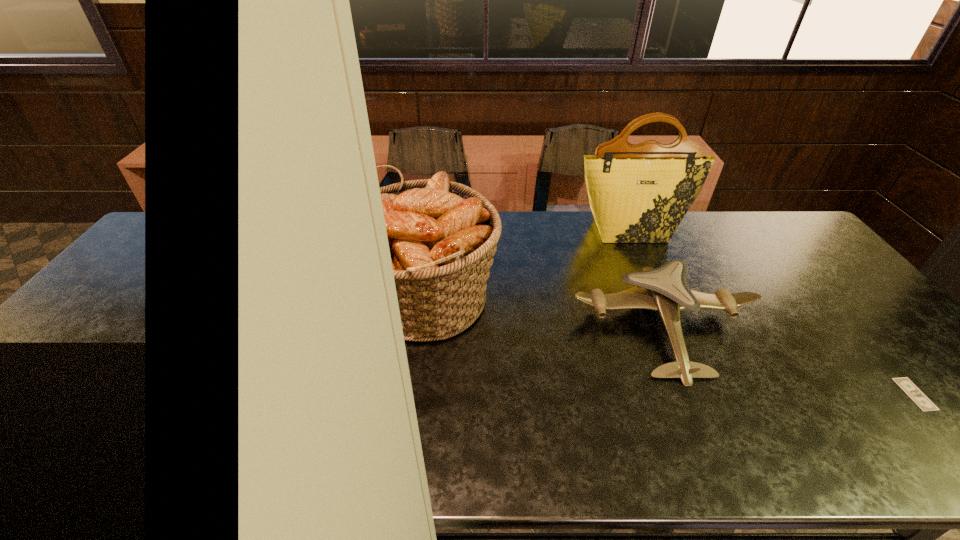
Where is `the farthest object`? This screenshot has height=540, width=960. the farthest object is located at coordinates (639, 193).

At what (x,y) coordinates should I click in order to perform the action: click on tote bag. Please return your answer as a coordinate pair (x, y). The height and width of the screenshot is (540, 960). Looking at the image, I should click on (639, 193).

You are a GUI agent. You are given a task and a screenshot of the screen. Output one action in this format:
    pyautogui.click(x=<x>, y=<y>)
    Task: Click on the leftmost object
    
    Given the screenshot: What is the action you would take?
    pyautogui.click(x=442, y=235)

Find the location of a particular element. The image size is (960, 540). basket is located at coordinates (442, 235).

Image resolution: width=960 pixels, height=540 pixels. I want to click on the second shortest object, so click(x=665, y=289).

Where is `money`? This screenshot has width=960, height=540. money is located at coordinates (916, 395).

Where is `the shortest object`? This screenshot has width=960, height=540. the shortest object is located at coordinates (916, 395).

At what (x,y) coordinates should I click in order to perform the action: click on free point located on the front-facing side of the farthest object. Please return your answer as a coordinate pair (x, y). The image size is (960, 540). Looking at the image, I should click on (648, 271).

Identify the location of free space located 0.130m on the right of the leftmost object. (544, 301).

Where is `blank space located on the front-facing side of the second shortest object`? This screenshot has width=960, height=540. blank space located on the front-facing side of the second shortest object is located at coordinates (709, 438).